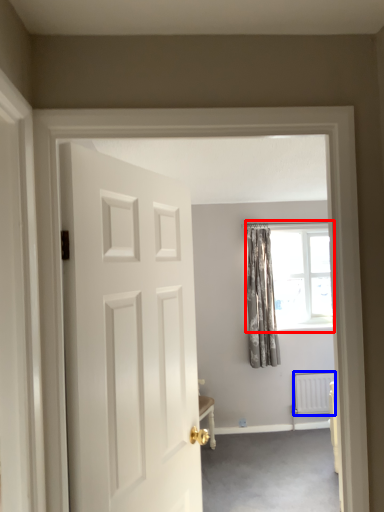
Question: Which point is closer to the camera, window (highlighted by a red box) or radiator (highlighted by a blue box)?

Choices:
 (A) window
 (B) radiator

Answer: (B)